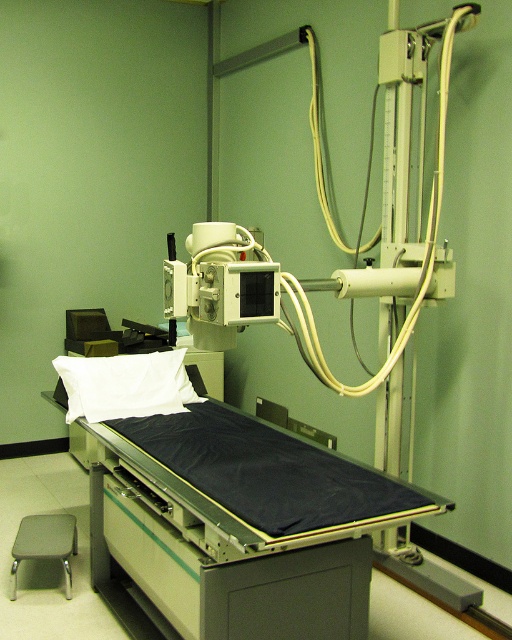
You are a medical technician standing at the camera position. You need to place a small sensor exactly at point (241, 566). The sensor has a diameter of 15 cm. Can you safely place it there without it being too close to the Xray machine?

The point (241, 566) is 1.99 meters from the camera, so yes, the sensor can be placed there safely as it is sufficiently distant from the Xray machine.

You are a patient preparing for an Xray and need to place your head on the white soft pillow at center. However, you notice a gray fabric stool at lower left nearby. Which object is closer to your right side when facing the Xray machine?

The white soft pillow at center is positioned on the right side of the gray fabric stool at lower left, so when facing the Xray machine, the white soft pillow at center is closer to your right side.